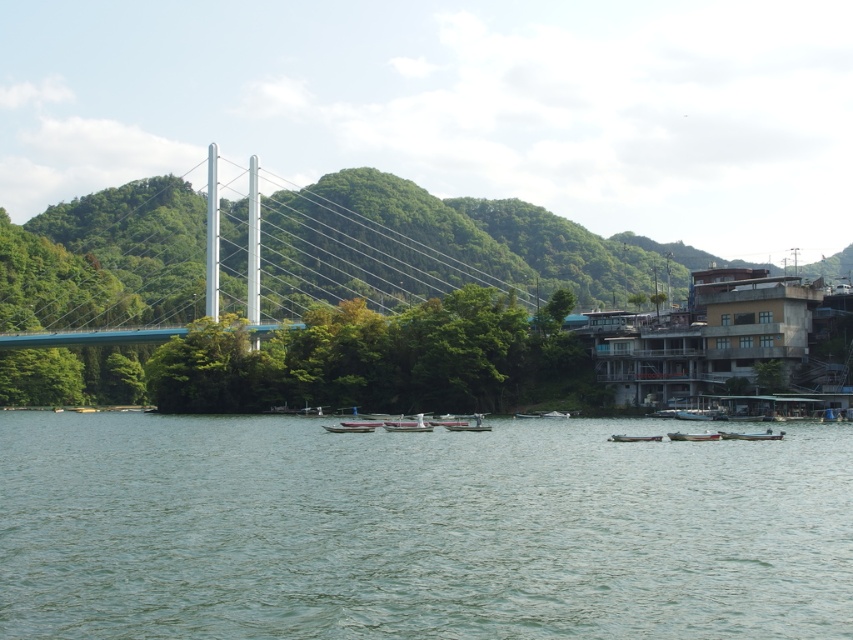
You are standing at the point closer to the camera between point (779, 438) and point (715, 436). Which point are you standing at?

You are standing at point (715, 436) because it is closer to the camera than point (779, 438).

You are planning to take a photo of the blue metallic suspension bridge at center from the riverside. To ensure the bridge is the main focus, where should you position yourself relative to the other elements in the scene?

The blue metallic suspension bridge at center is located at point (233, 259), so positioning yourself directly in front of this coordinate would ensure the bridge is the main focus while avoiding obstructions from other elements like the boats or hills.

You are standing on the suspension bridge and want to move from the metallic silver boat at lower right to the wooden boat at center. Can you walk directly between them without getting wet?

The distance between the metallic silver boat at lower right and the wooden boat at center is 2.88 meters. Since you are on the suspension bridge, you can walk directly between them without getting wet as the bridge provides a dry path.